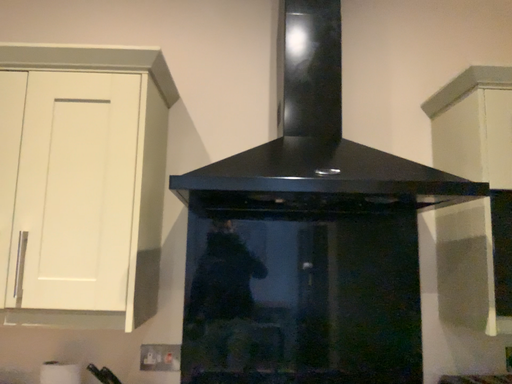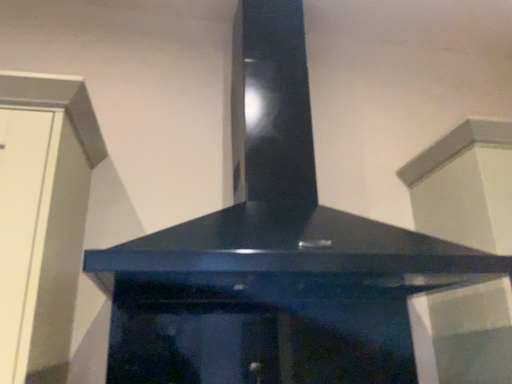
Question: How did the camera likely rotate when shooting the video?

Choices:
 (A) rotated downward
 (B) rotated upward

Answer: (B)